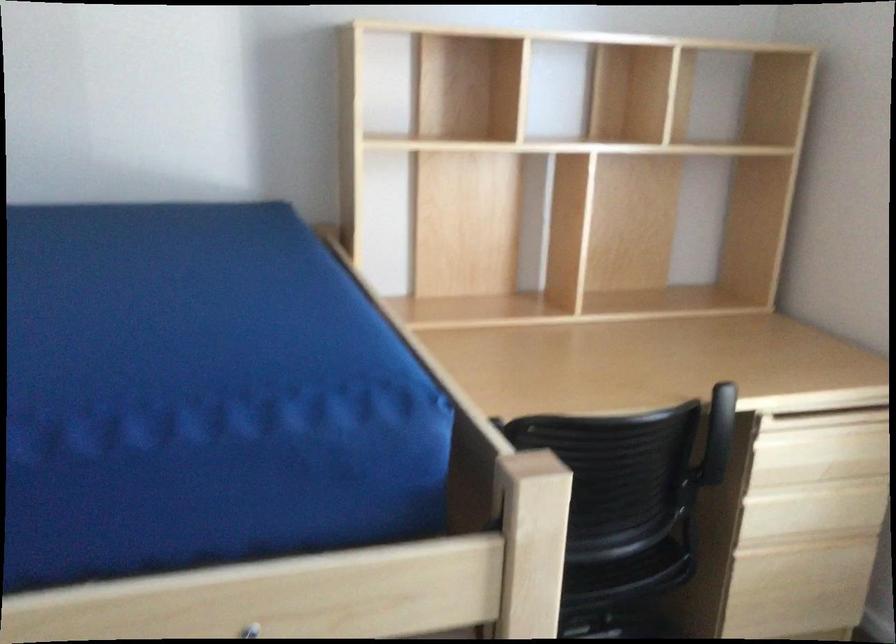
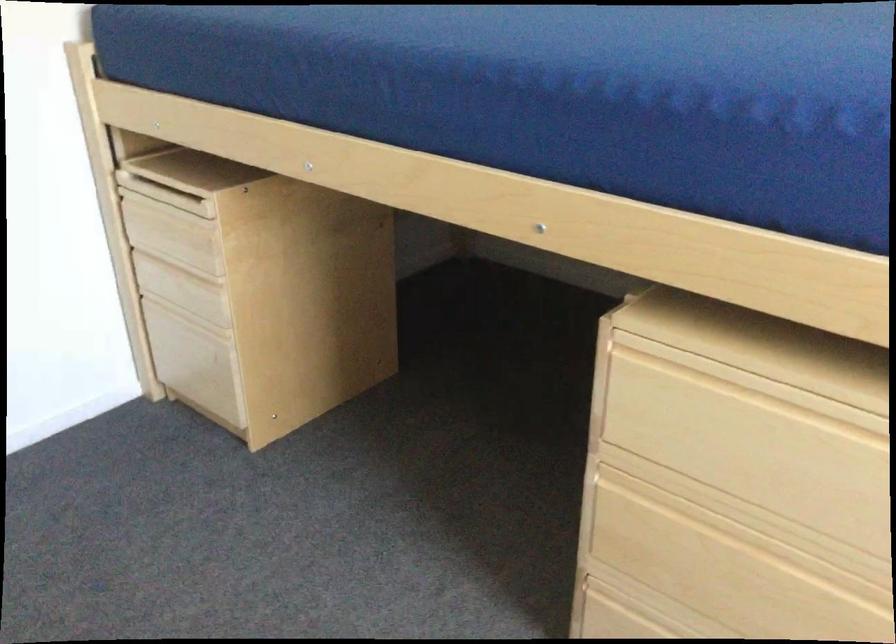
Question: The images are taken continuously from a first-person perspective. In which direction is your viewpoint rotating?

Choices:
 (A) Left
 (B) Right
 (C) Up
 (D) Down

Answer: (A)